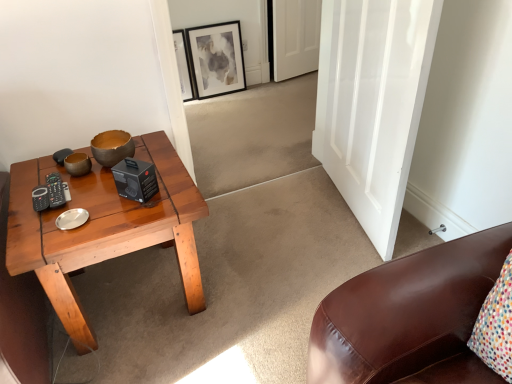
Where is `vacant area that is in front of matte black picture frame at upper center`? The image size is (512, 384). vacant area that is in front of matte black picture frame at upper center is located at coordinates (218, 105).